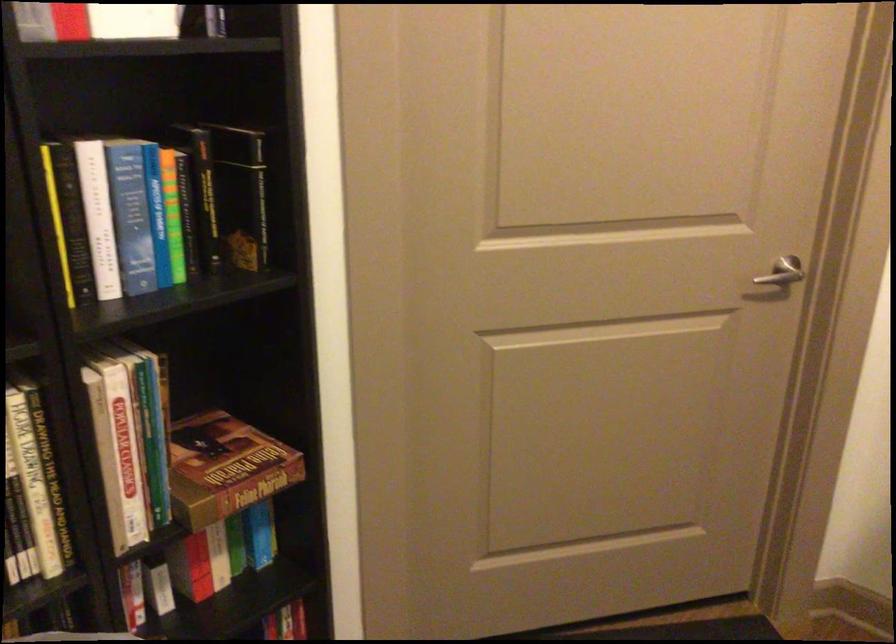
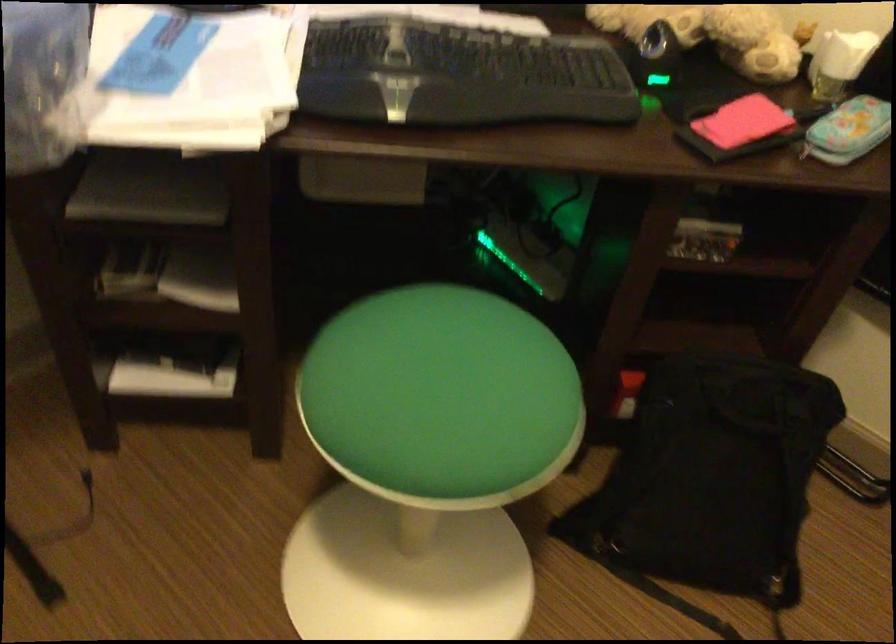
Based on the continuous images, in which direction is the camera rotating?

The rotation direction of the camera is right-down.